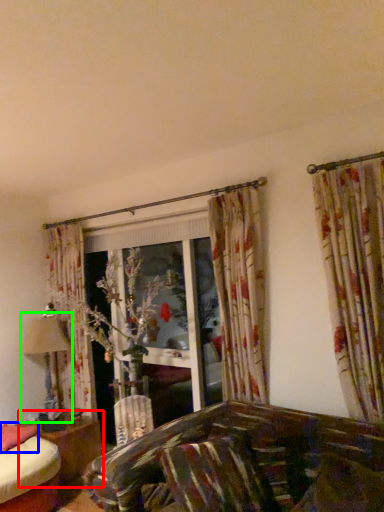
Question: Which object is the farthest from table (highlighted by a red box)? Choose among these: pillow (highlighted by a blue box) or table lamp (highlighted by a green box).

Choices:
 (A) pillow
 (B) table lamp

Answer: (B)